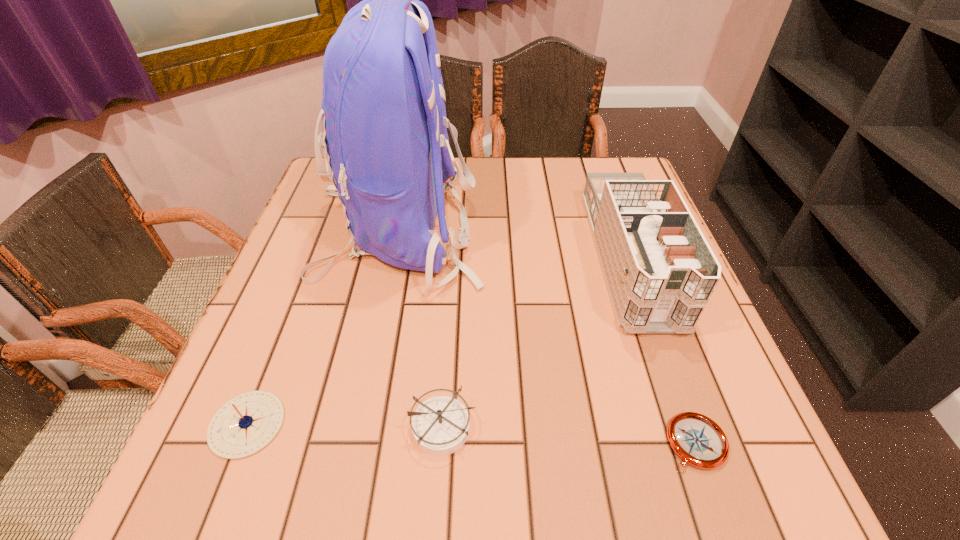
Locate an element on the screen. Image resolution: width=960 pixels, height=540 pixels. vacant space positioned 0.120m on the back of the rightmost compass is located at coordinates click(x=664, y=354).

Image resolution: width=960 pixels, height=540 pixels. Find the location of `backpack that is at the far edge`. backpack that is at the far edge is located at coordinates (384, 123).

Locate an element on the screen. dollhouse that is at the far edge is located at coordinates (660, 271).

At what (x,y) coordinates should I click in order to perform the action: click on backpack at the left edge. Please return your answer as a coordinate pair (x, y). The width and height of the screenshot is (960, 540). Looking at the image, I should click on (384, 123).

I want to click on compass at the left edge, so click(x=244, y=425).

The image size is (960, 540). In order to click on dollhouse that is at the right edge in this screenshot , I will do `click(660, 271)`.

Locate an element on the screen. The image size is (960, 540). compass situated at the right edge is located at coordinates (699, 441).

At what (x,y) coordinates should I click in order to perform the action: click on object at the far left corner. Please return your answer as a coordinate pair (x, y). Looking at the image, I should click on (384, 123).

The height and width of the screenshot is (540, 960). I want to click on object that is at the near left corner, so click(244, 425).

Locate an element on the screen. object at the far right corner is located at coordinates (660, 271).